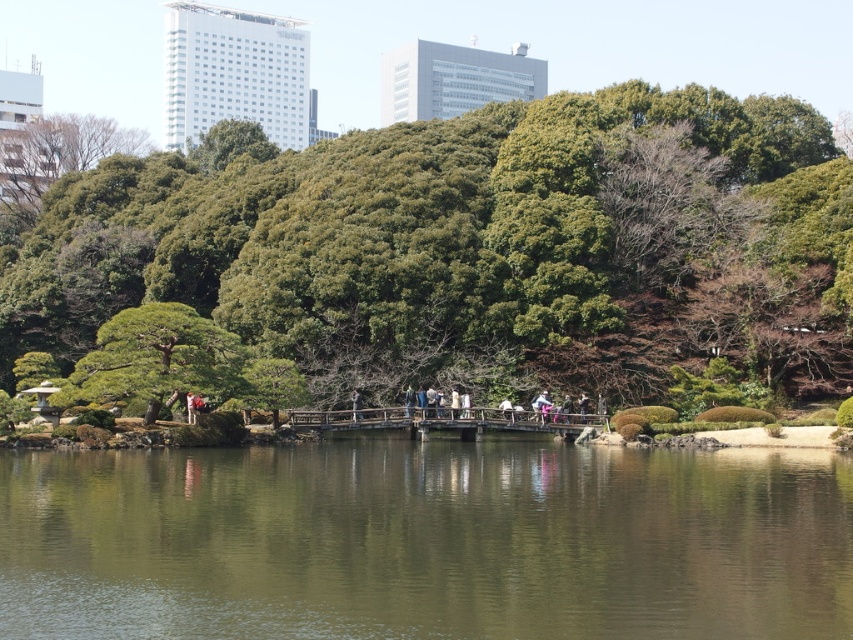
In the scene shown: You are standing at the edge of the water in the scene. There is a green leafy tree at center marked by point (473, 246). If you want to walk directly towards the green leafy tree at center, which direction should you face?

You should face towards the center of the scene to walk directly towards the green leafy tree at center marked by point (473, 246).

You are standing on the wooden bridge and want to place a small bench between the green reflective water at center and the green textured tree at center. Which object should the bench be closer to to ensure it fits within the available space?

The green reflective water at center is wider than the green textured tree at center. Therefore, the bench should be placed closer to the green textured tree at center to accommodate the space constraints.